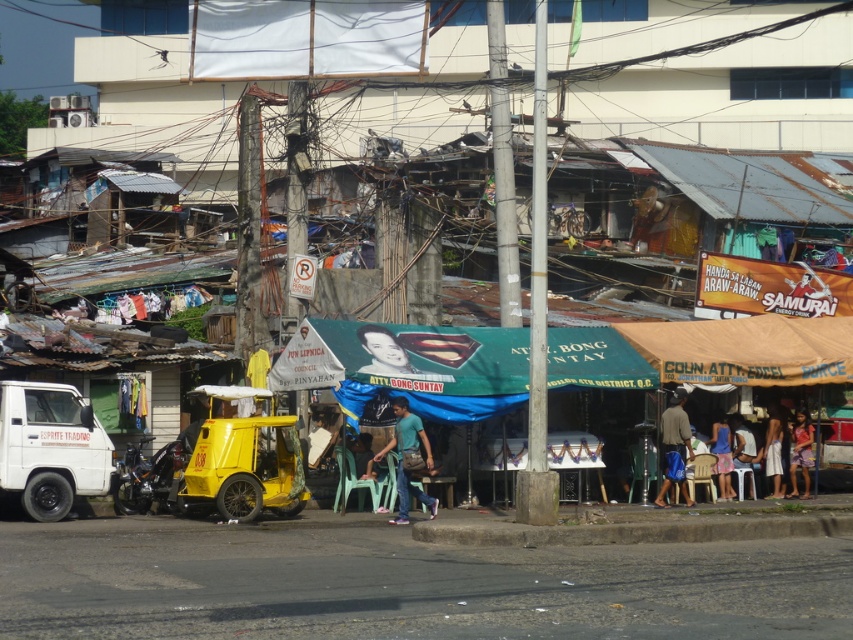
Is green fabric canopy at center below light brown plastic chair at lower right?

Incorrect, green fabric canopy at center is not positioned below light brown plastic chair at lower right.

You are a GUI agent. You are given a task and a screenshot of the screen. Output one action in this format:
    pyautogui.click(x=<x>, y=<y>)
    Task: Click on the green fabric canopy at center
    The width and height of the screenshot is (853, 640).
    Given the screenshot: What is the action you would take?
    pyautogui.click(x=408, y=365)

The height and width of the screenshot is (640, 853). What do you see at coordinates (408, 365) in the screenshot? I see `green fabric canopy at center` at bounding box center [408, 365].

Measure the distance between green fabric canopy at center and camera.

A distance of 76.41 feet exists between green fabric canopy at center and camera.

Looking at this image, measure the distance between point (430, 416) and camera.

Point (430, 416) is 23.93 meters from camera.

This screenshot has height=640, width=853. Find the location of `green fabric canopy at center`. green fabric canopy at center is located at coordinates (408, 365).

Which is more to the right, dark brown fabric pants at center or smooth plastic poster at center?

dark brown fabric pants at center

Which of these two, dark brown fabric pants at center or smooth plastic poster at center, stands taller?

Standing taller between the two is dark brown fabric pants at center.

The width and height of the screenshot is (853, 640). Identify the location of dark brown fabric pants at center. (675, 428).